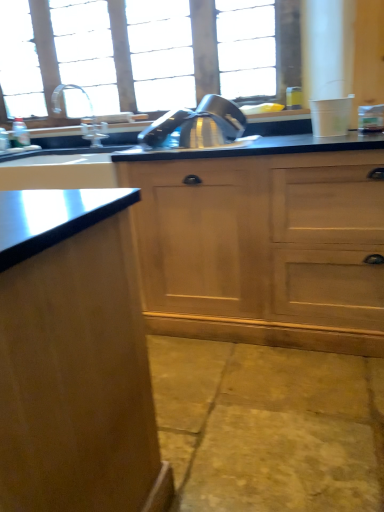
Question: Would you say yellow stone concrete at lower center is a long distance from satin nickel faucet at upper left?

Choices:
 (A) no
 (B) yes

Answer: (B)

Question: Is yellow stone concrete at lower center bigger than satin nickel faucet at upper left?

Choices:
 (A) yes
 (B) no

Answer: (A)

Question: Is yellow stone concrete at lower center facing towards satin nickel faucet at upper left?

Choices:
 (A) no
 (B) yes

Answer: (A)

Question: Does yellow stone concrete at lower center have a lesser height compared to satin nickel faucet at upper left?

Choices:
 (A) yes
 (B) no

Answer: (A)

Question: Does yellow stone concrete at lower center have a greater height compared to satin nickel faucet at upper left?

Choices:
 (A) no
 (B) yes

Answer: (A)

Question: Is yellow stone concrete at lower center further to camera compared to satin nickel faucet at upper left?

Choices:
 (A) yes
 (B) no

Answer: (B)

Question: Considering the relative sizes of wooden cabinet at center and yellow stone concrete at lower center in the image provided, is wooden cabinet at center smaller than yellow stone concrete at lower center?

Choices:
 (A) no
 (B) yes

Answer: (A)

Question: Does wooden cabinet at center appear on the right side of yellow stone concrete at lower center?

Choices:
 (A) yes
 (B) no

Answer: (B)

Question: From the image's perspective, is wooden cabinet at center located above yellow stone concrete at lower center?

Choices:
 (A) yes
 (B) no

Answer: (A)

Question: Is wooden cabinet at center bigger than yellow stone concrete at lower center?

Choices:
 (A) yes
 (B) no

Answer: (A)

Question: From a real-world perspective, is wooden cabinet at center positioned over yellow stone concrete at lower center based on gravity?

Choices:
 (A) yes
 (B) no

Answer: (A)

Question: Is wooden cabinet at center not near yellow stone concrete at lower center?

Choices:
 (A) yes
 (B) no

Answer: (B)

Question: Does satin nickel faucet at upper left have a lesser height compared to yellow stone concrete at lower center?

Choices:
 (A) no
 (B) yes

Answer: (A)